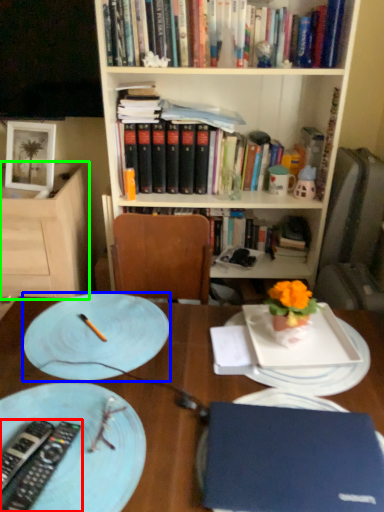
Question: Which object is positioned farthest from remote control (highlighted by a red box)? Select from plate (highlighted by a blue box) and shelf (highlighted by a green box).

Choices:
 (A) plate
 (B) shelf

Answer: (B)